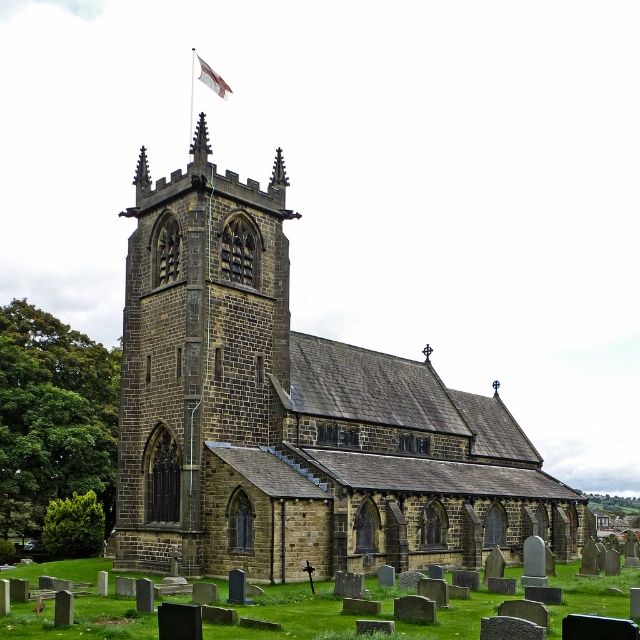
You are standing in the cemetery in front of the church. You want to walk directly towards the brown stone tower at center. However, there is a brown stone church at center in your path. Can you walk straight ahead without going around the church?

The brown stone tower at center is behind the brown stone church at center, so you cannot walk straight ahead towards the tower without going around the church.

You are a drone operator tasked with capturing aerial footage of the brown stone tower at center and the white fabric flag at upper center. Your drone has a maximum flight range of 120 feet. Can your drone safely capture footage of both objects without needing to recharge or return to base?

The distance between the brown stone tower at center and the white fabric flag at upper center is 118.13 feet, which is within the drone operator s maximum flight range of 120 feet. Therefore, the drone can safely capture footage of both objects without needing to recharge or return to base.